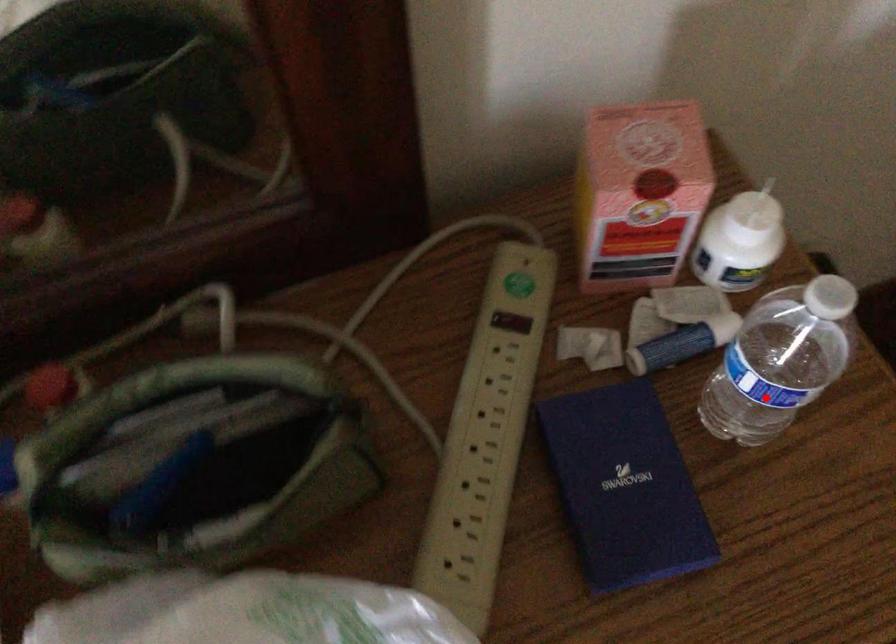
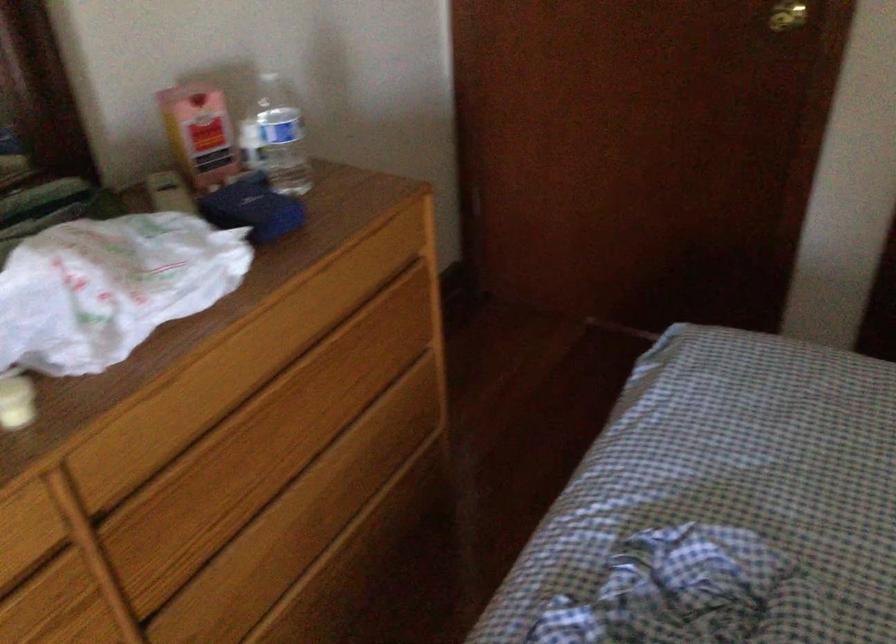
Find the pixel in the second image that matches the highlighted location in the first image.

(276, 138)